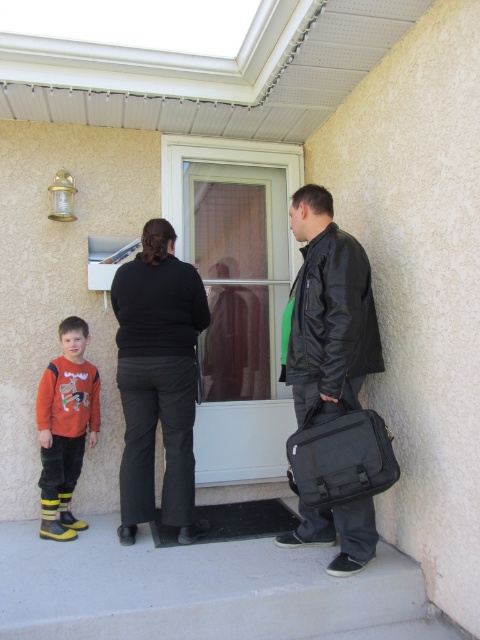
You are standing at the point marked as point (355,339) in the image. You want to take a photo of the woman in black pants and black top who is facing away from the camera. Can you turn around to face the camera while staying at your current position?

Yes, you can turn around to face the camera while staying at your current position because the point (355,339) is 2.45 meters away from the viewer, which allows enough space to turn around without moving your position.

You are a delivery person who needs to place a small package on the ground between the black leather jacket at right and the black fabric bag at lower right. Based on their widths, which object should you place the package closer to to ensure it fits within the space?

The black leather jacket at right is wider than the black fabric bag at lower right. To ensure the package fits within the space, place it closer to the narrower black fabric bag at lower right.